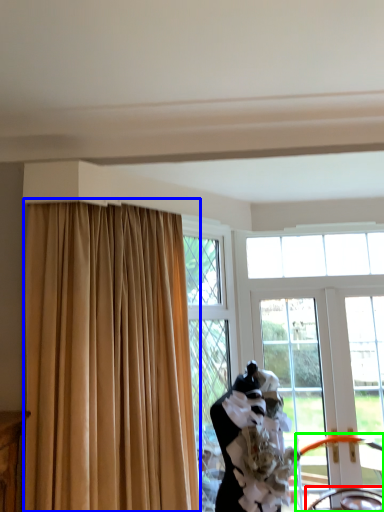
Question: Which is nearer to the chair (highlighted by a red box)? curtain (highlighted by a blue box) or chair (highlighted by a green box).

Choices:
 (A) curtain
 (B) chair

Answer: (B)